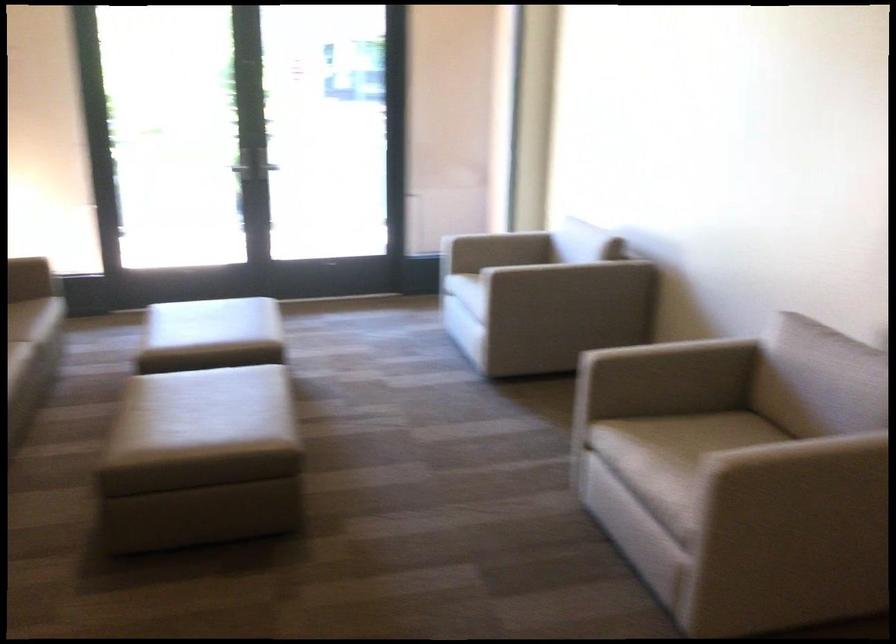
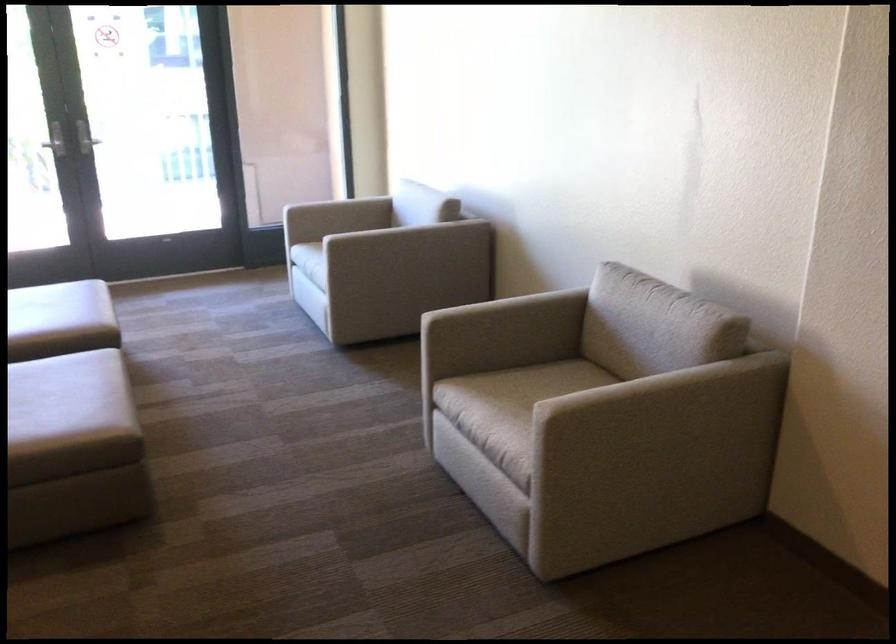
Question: The first image is from the beginning of the video and the second image is from the end. How did the camera likely rotate when shooting the video?

Choices:
 (A) Left
 (B) Right
 (C) Up
 (D) Down

Answer: (B)